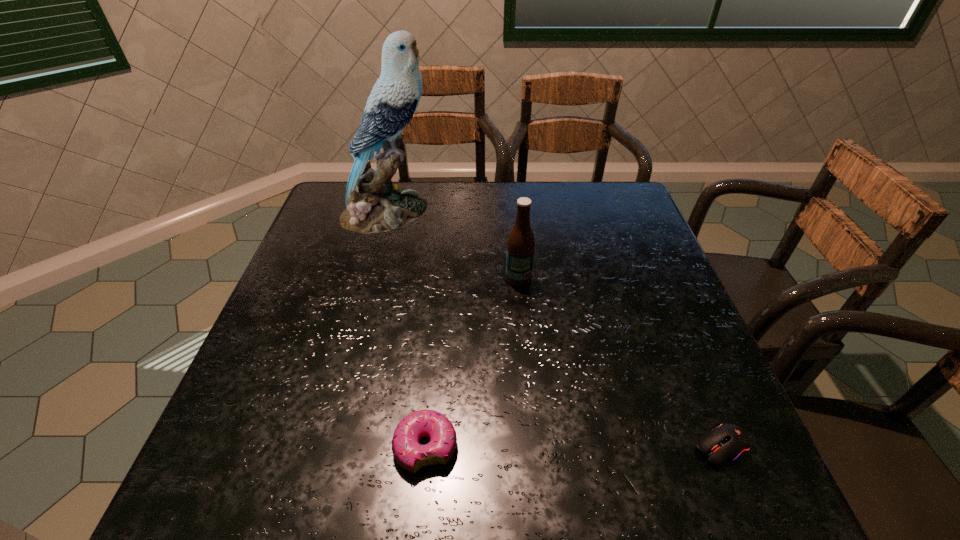
Locate an element on the screen. free space that satisfies the following two spatial constraints: 1. on the face of the rightmost object; 2. on the left side of the farthest object is located at coordinates (325, 448).

The image size is (960, 540). Identify the location of free space that satisfies the following two spatial constraints: 1. on the face of the tallest object; 2. on the back side of the third tallest object. (325, 447).

Where is `vacant area that satisfies the following two spatial constraints: 1. on the face of the tallest object; 2. on the back side of the third nearest object`? The width and height of the screenshot is (960, 540). vacant area that satisfies the following two spatial constraints: 1. on the face of the tallest object; 2. on the back side of the third nearest object is located at coordinates (371, 279).

Image resolution: width=960 pixels, height=540 pixels. In order to click on free region that satisfies the following two spatial constraints: 1. on the face of the tallest object; 2. on the right side of the third tallest object in this screenshot , I will do [325, 447].

Find the location of `blank area in the image that satisfies the following two spatial constraints: 1. on the front side of the shortest object; 2. on the right side of the doughnut`. blank area in the image that satisfies the following two spatial constraints: 1. on the front side of the shortest object; 2. on the right side of the doughnut is located at coordinates (425, 448).

The height and width of the screenshot is (540, 960). I want to click on free space that satisfies the following two spatial constraints: 1. on the face of the rightmost object; 2. on the left side of the parakeet, so (325, 448).

Identify the location of vacant space that satisfies the following two spatial constraints: 1. on the back side of the third tallest object; 2. on the face of the parakeet. Image resolution: width=960 pixels, height=540 pixels. (447, 212).

The width and height of the screenshot is (960, 540). What are the coordinates of `vacant position in the image that satisfies the following two spatial constraints: 1. on the face of the tallest object; 2. on the back side of the third object from left to right` in the screenshot? It's located at (371, 279).